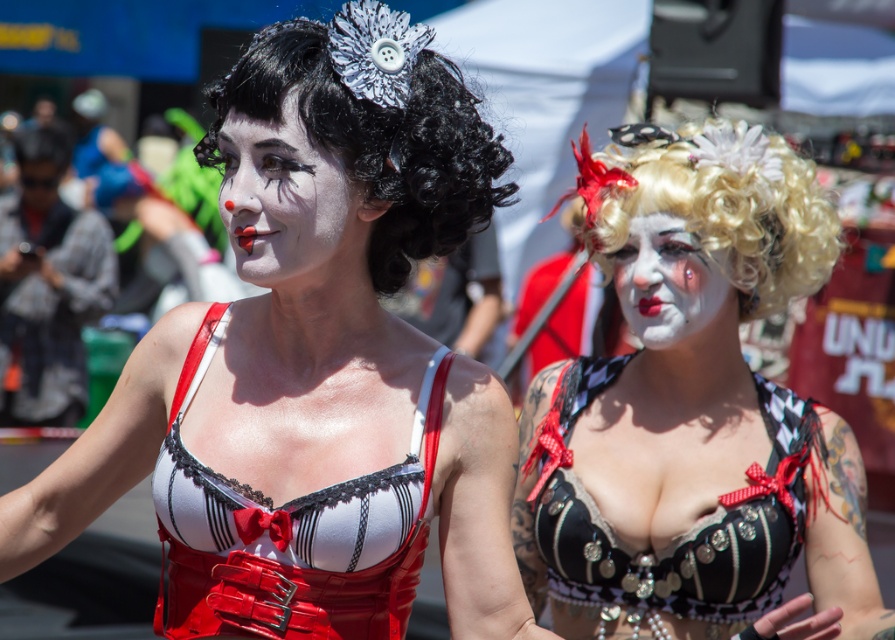
You are a photographer trying to capture a clear shot of both the matte black bra at center and the matte white face at center. Which object should you focus on first to ensure it appears sharp in the photo?

You should focus on the matte black bra at center first because it is closer to the viewer, ensuring it will be in sharp focus. The matte white face at center is further away, so adjusting focus afterward may be necessary for both to be clear.